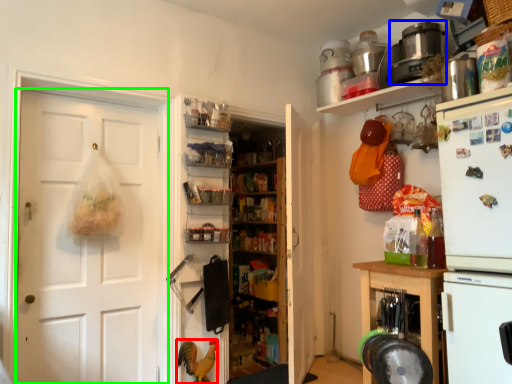
Question: Which is nearer to the chicken (highlighted by a red box)? appliance (highlighted by a blue box) or door (highlighted by a green box).

Choices:
 (A) appliance
 (B) door

Answer: (B)